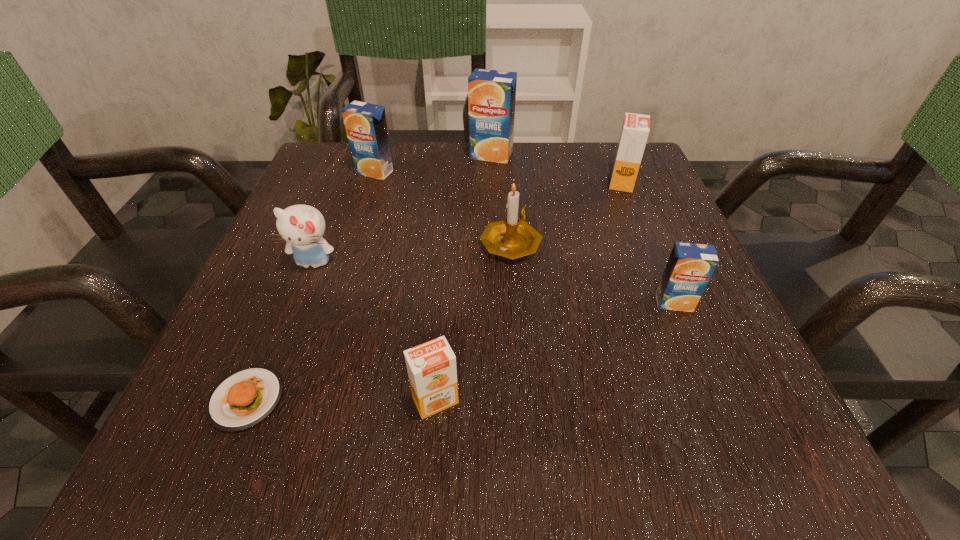
I want to click on vacant region at the near edge of the desktop, so click(579, 422).

Locate an element on the screen. The width and height of the screenshot is (960, 540). vacant region at the left edge of the desktop is located at coordinates (350, 204).

This screenshot has height=540, width=960. Identify the location of vacant area at the right edge of the desktop. (699, 341).

Where is `free space at the far left corner of the desktop`? The width and height of the screenshot is (960, 540). free space at the far left corner of the desktop is located at coordinates (354, 187).

Where is `free space that is in between the kitten and the rightmost blue orange_juice`? This screenshot has height=540, width=960. free space that is in between the kitten and the rightmost blue orange_juice is located at coordinates (493, 282).

Image resolution: width=960 pixels, height=540 pixels. What are the coordinates of `unoccupied position between the biggest blue orange_juice and the gold candle holder` in the screenshot? It's located at (501, 199).

The width and height of the screenshot is (960, 540). What are the coordinates of `blank region between the farther orange orange juice and the leftmost orange juice` in the screenshot? It's located at (498, 177).

You are a GUI agent. You are given a task and a screenshot of the screen. Output one action in this format:
    pyautogui.click(x=<x>, y=<y>)
    Task: Click on the free space between the farther orange orange juice and the second blue orange_juice from left to right
    
    Given the screenshot: What is the action you would take?
    pyautogui.click(x=557, y=168)

The width and height of the screenshot is (960, 540). I want to click on free point between the farther orange orange juice and the gold candle holder, so click(x=566, y=212).

The image size is (960, 540). What are the coordinates of `vacant space in between the rightmost blue orange_juice and the kitten` in the screenshot? It's located at (493, 282).